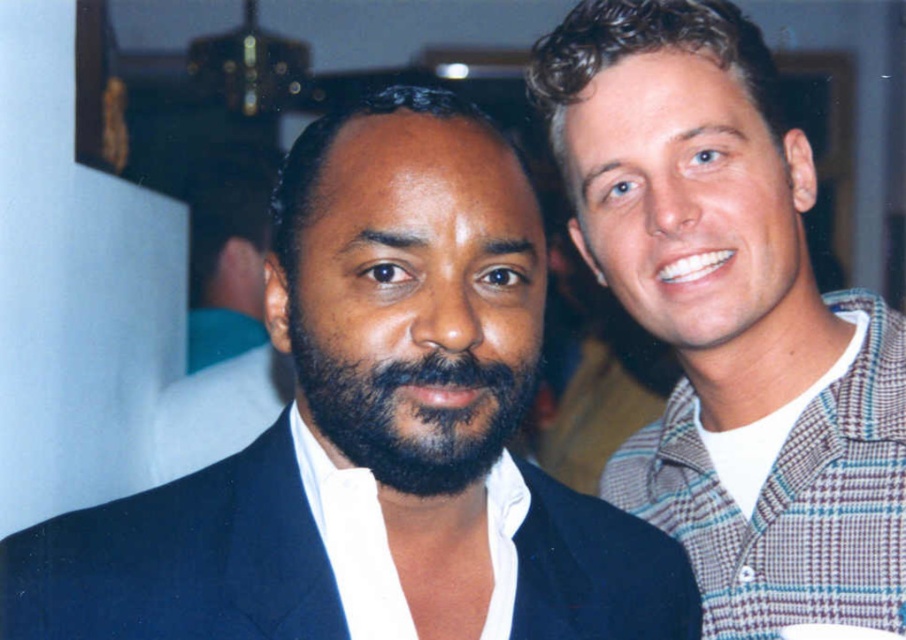
Does point (613, 513) come closer to viewer compared to point (459, 372)?

No, (613, 513) is behind (459, 372).

Is dark blue suit at center wider than dark brown fuzzy beard at center?

Yes, dark blue suit at center is wider than dark brown fuzzy beard at center.

This screenshot has width=906, height=640. Describe the element at coordinates (373, 435) in the screenshot. I see `dark blue suit at center` at that location.

Locate an element on the screen. This screenshot has width=906, height=640. dark blue suit at center is located at coordinates (373, 435).

Between dark blue suit at center and plaid shirt at right, which one is positioned higher?

plaid shirt at right is above.

Is point (474, 225) farther from viewer compared to point (673, 512)?

No.

The height and width of the screenshot is (640, 906). I want to click on dark blue suit at center, so click(373, 435).

Is plaid shirt at right smaller than dark brown fuzzy beard at center?

Incorrect, plaid shirt at right is not smaller in size than dark brown fuzzy beard at center.

Does plaid shirt at right have a greater height compared to dark brown fuzzy beard at center?

Yes.

In order to click on plaid shirt at right in this screenshot , I will do `click(731, 321)`.

Locate an element on the screen. This screenshot has height=640, width=906. plaid shirt at right is located at coordinates (731, 321).